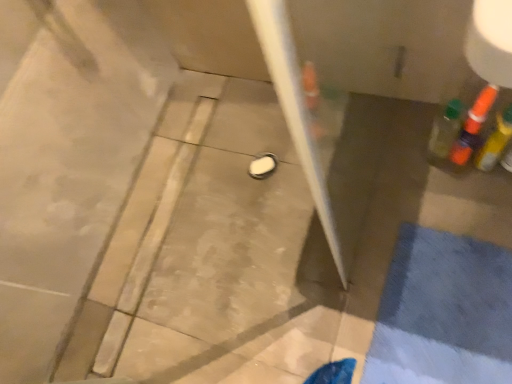
Locate an element on the screen. vacant area that is in front of translucent plastic bottle at right, which is counted as the first bottle, starting from the left is located at coordinates (464, 201).